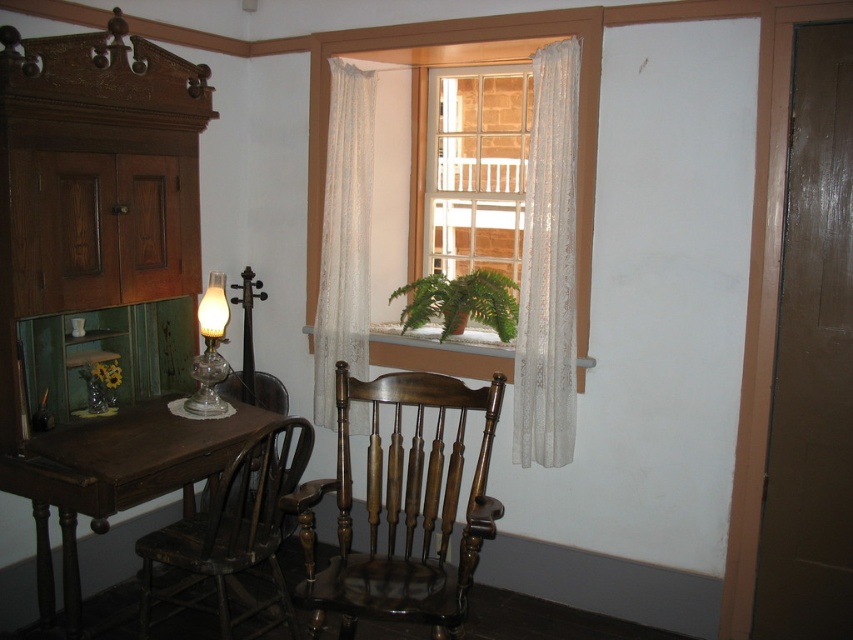
The image size is (853, 640). Describe the element at coordinates (474, 166) in the screenshot. I see `clear glass window at center` at that location.

Who is shorter, clear glass window at center or white lace curtain at center?

clear glass window at center is shorter.

The width and height of the screenshot is (853, 640). What do you see at coordinates (474, 166) in the screenshot?
I see `clear glass window at center` at bounding box center [474, 166].

I want to click on clear glass window at center, so click(474, 166).

Which of these two, white lace curtain at center or wooden rocking chair at center, stands taller?

white lace curtain at center

Between white lace curtain at center and wooden rocking chair at center, which one appears on the right side from the viewer's perspective?

Positioned to the right is white lace curtain at center.

Image resolution: width=853 pixels, height=640 pixels. I want to click on white lace curtain at center, so click(344, 236).

Does dark brown wood chair at lower left appear on the right side of transparent glass oil lamp at center?

Yes, dark brown wood chair at lower left is to the right of transparent glass oil lamp at center.

Is dark brown wood chair at lower left bigger than transparent glass oil lamp at center?

Correct, dark brown wood chair at lower left is larger in size than transparent glass oil lamp at center.

Is point (276, 522) closer to viewer compared to point (190, 374)?

Yes, it is in front of point (190, 374).

Where is `dark brown wood chair at lower left`? The height and width of the screenshot is (640, 853). dark brown wood chair at lower left is located at coordinates (234, 529).